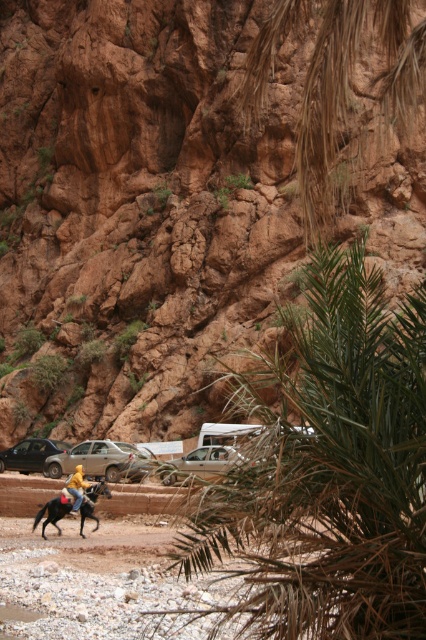
Consider the image. You are a photographer trying to capture both the silver metallic car at lower left and the silver metallic car at center in the same frame. Which car should you move closer to if you want the taller car to appear larger in the photo?

You should move closer to the silver metallic car at center because it is taller than the silver metallic car at lower left, so moving closer to it will make it appear larger in the photo.

You are planning to take a photo of the matte black car at left and the green leafy palm tree at center. Which object should you focus on first if you want both to be in sharp focus?

The green leafy palm tree at center is larger in size than the matte black car at left, so you should focus on the larger object first to ensure both are in sharp focus.